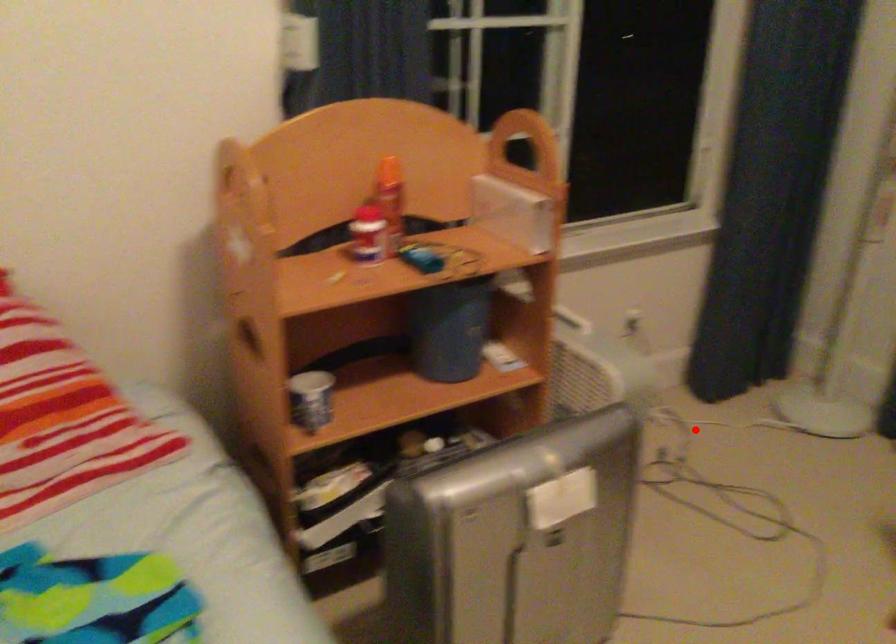
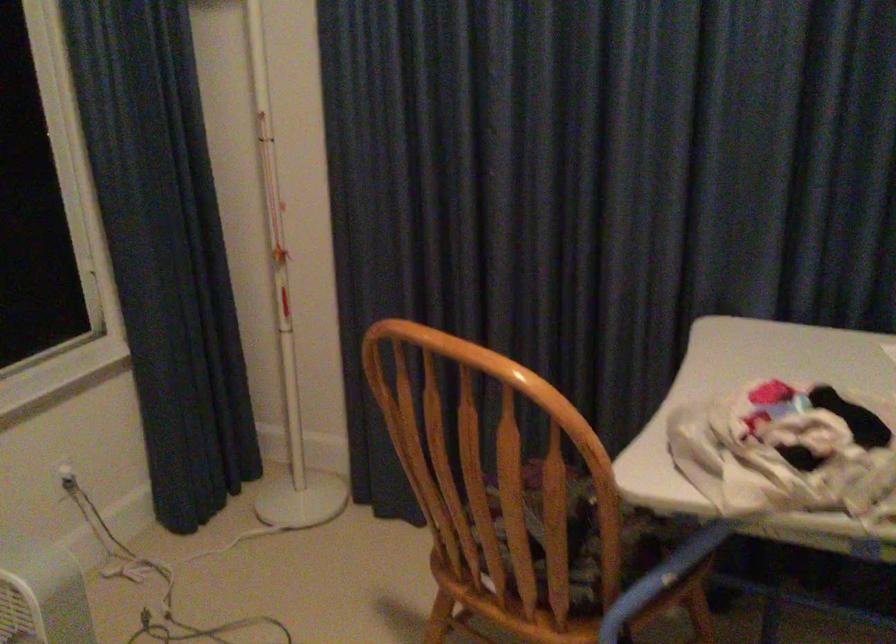
Question: I am providing you with two images of the same scene from different viewpoints. Given a red point in image1, look at the same physical point in image2. Is it:

Choices:
 (A) Closer to the viewpoint
 (B) Farther from the viewpoint

Answer: (A)